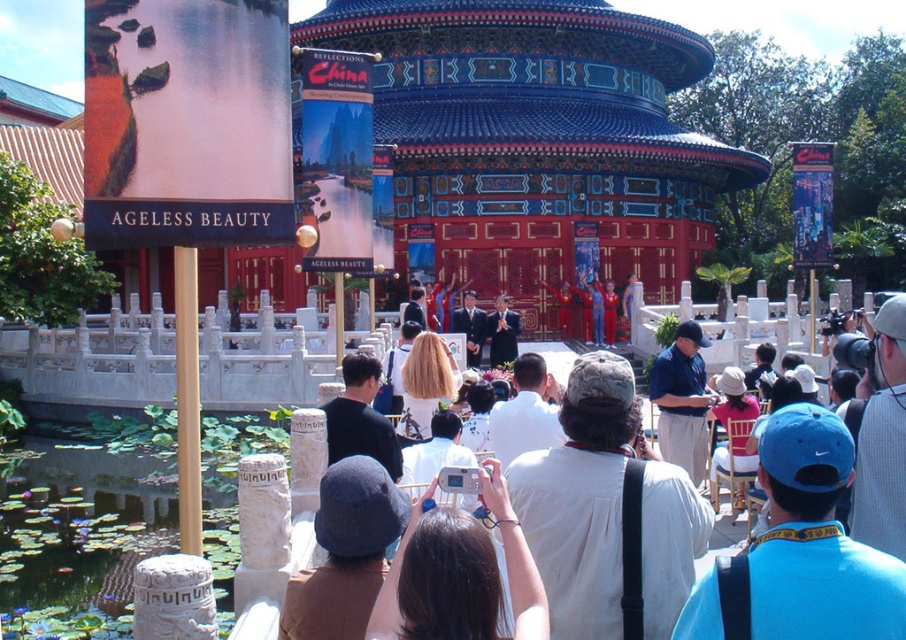
You are standing in the crowd facing the pavilion and want to take a photo of the pavilion using the white plastic camera at center. Where should you position the camera to ensure the pavilion is fully captured in the frame?

Position the white plastic camera at center at point (x=439, y=580) to ensure the pavilion is fully captured in the frame.

You are a photographer standing in front of the traditional Chinese pavilion. You notice two hats in the center of the scene, a camouflage hat at center and a dark blue felt hat at center. Which hat is more likely to block your view of the pavilion?

The camouflage hat at center is much taller than the dark blue felt hat at center, so it is more likely to block your view of the pavilion.

You are a photographer standing in the crowd facing the pavilion. You notice the green lily pads at lower left and the blue fabric cap at center. Which object would appear bigger in your camera viewfinder?

The green lily pads at lower left would appear bigger in the camera viewfinder since they are larger in size than the blue fabric cap at center.